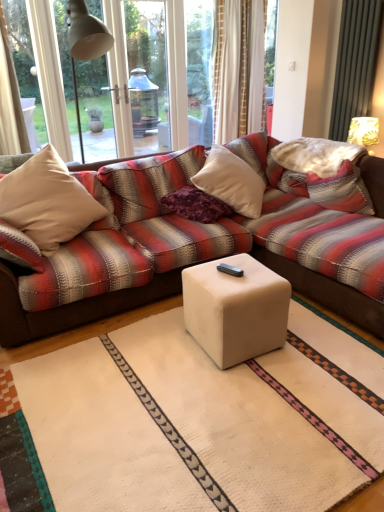
Locate an element on the screen. The image size is (384, 512). free space above white matte cube at center (from a real-world perspective) is located at coordinates (234, 272).